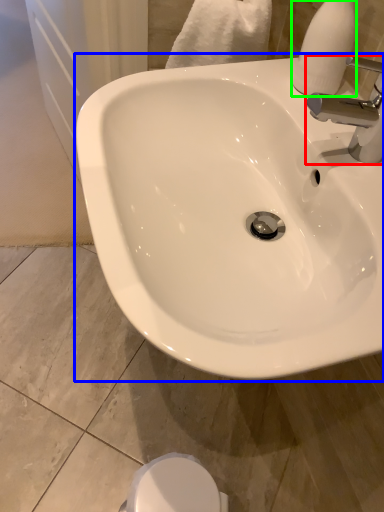
Question: Estimate the real-world distances between objects in this image. Which object is closer to tap (highlighted by a red box), sink (highlighted by a blue box) or soap dispenser (highlighted by a green box)?

Choices:
 (A) sink
 (B) soap dispenser

Answer: (B)